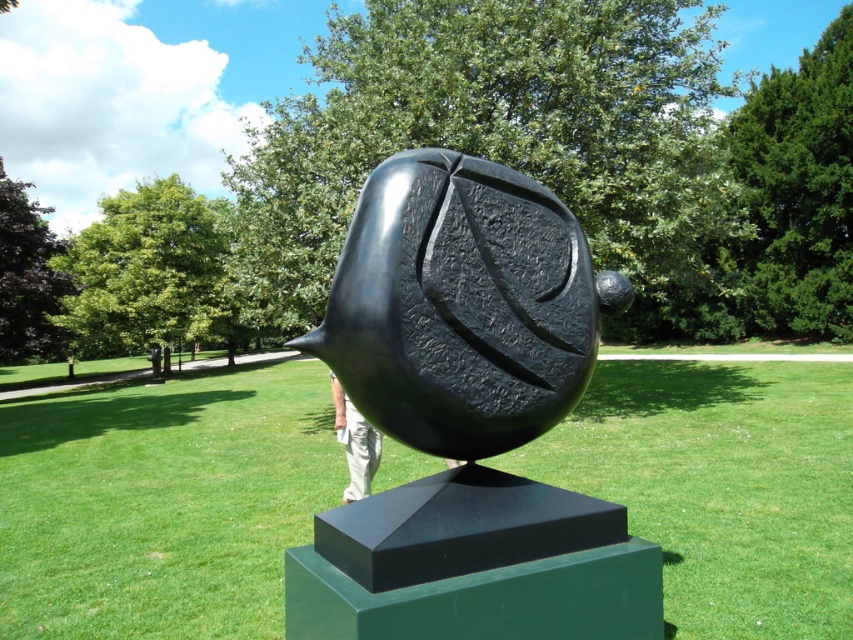
Is black polished stone sphere at center bigger than tan fabric pants at center?

Correct, black polished stone sphere at center is larger in size than tan fabric pants at center.

Locate an element on the screen. The width and height of the screenshot is (853, 640). black polished stone sphere at center is located at coordinates (466, 420).

Does point (422, 388) come farther from viewer compared to point (346, 397)?

No, (422, 388) is closer to viewer.

Identify the location of black polished stone sphere at center. (466, 420).

Is green grass at center to the right of tan fabric pants at center from the viewer's perspective?

Correct, you'll find green grass at center to the right of tan fabric pants at center.

Is point (134, 593) closer to camera compared to point (370, 470)?

Yes.

Who is more distant from viewer, (x=102, y=573) or (x=376, y=435)?

Positioned behind is point (x=376, y=435).

Where is `green grass at center`? The height and width of the screenshot is (640, 853). green grass at center is located at coordinates (161, 502).

Which is in front, point (157, 433) or point (485, 476)?

Positioned in front is point (485, 476).

Does green grass at center have a greater height compared to black polished stone sphere at center?

No, green grass at center is not taller than black polished stone sphere at center.

The width and height of the screenshot is (853, 640). In order to click on green grass at center in this screenshot , I will do `click(161, 502)`.